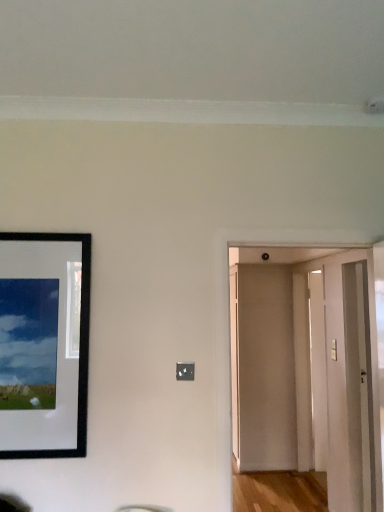
Question: From the image's perspective, relative to white glossy door at right, the second door from the back, is beige matte door at center, placed as the 1th door when sorted from back to front, above or below?

Choices:
 (A) above
 (B) below

Answer: (A)

Question: Is beige matte door at center, marked as the 3th door in a front-to-back arrangement, bigger or smaller than white glossy door at right, which appears as the 2th door when viewed from the front?

Choices:
 (A) big
 (B) small

Answer: (A)

Question: Based on their relative distances, which object is nearer to the white glossy door at right, which appears as the 2th door when viewed from the front?

Choices:
 (A) black matte picture frame at left
 (B) white wooden door at center, the 3th door in the back-to-front sequence
 (C) transparent glass door at right
 (D) beige matte door at center, marked as the 3th door in a front-to-back arrangement

Answer: (B)

Question: Considering the real-world distances, which object is closest to the black matte picture frame at left?

Choices:
 (A) white wooden door at center, the 3th door in the back-to-front sequence
 (B) white glossy door at right, the second door from the back
 (C) beige matte door at center, marked as the 3th door in a front-to-back arrangement
 (D) transparent glass door at right

Answer: (D)